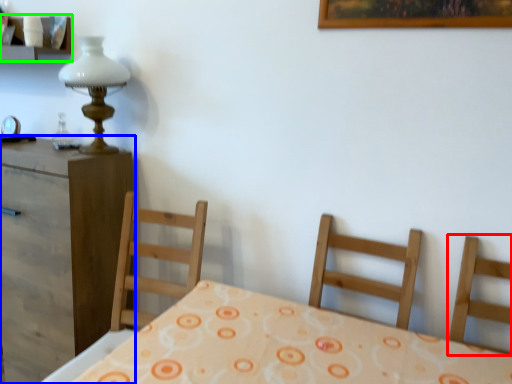
Question: Which object is positioned closest to chair (highlighted by a red box)? Select from nightstand (highlighted by a blue box) and shelf (highlighted by a green box).

Choices:
 (A) nightstand
 (B) shelf

Answer: (A)